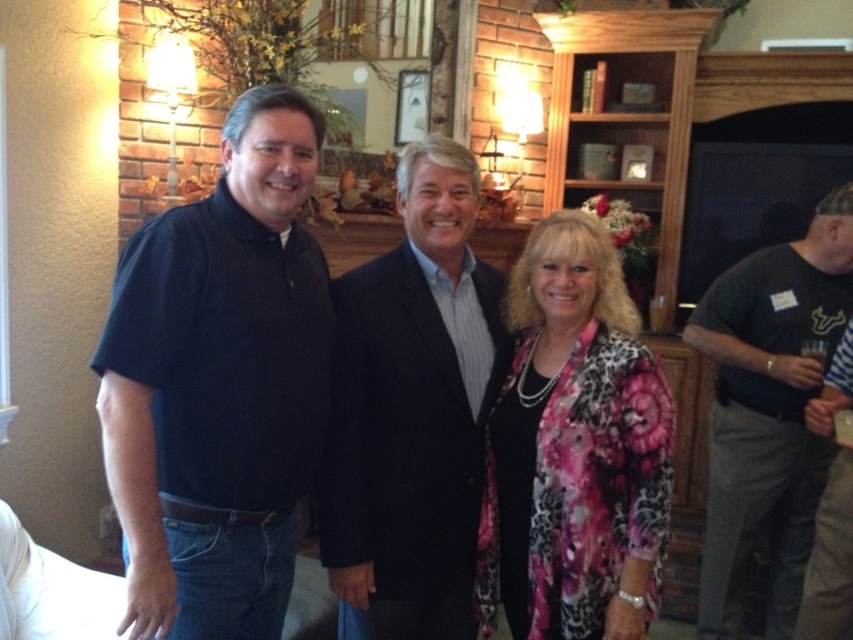
Question: Estimate the real-world distances between objects in this image. Which object is farther from the striped shirt at right?

Choices:
 (A) dark blue suit at center
 (B) dark gray t-shirt at right
 (C) pink floral jacket at center
 (D) dark blue polo shirt at left

Answer: (D)

Question: Does dark blue polo shirt at left have a larger size compared to pink floral jacket at center?

Choices:
 (A) no
 (B) yes

Answer: (B)

Question: Can you confirm if dark blue polo shirt at left is wider than dark blue suit at center?

Choices:
 (A) yes
 (B) no

Answer: (B)

Question: Which object is positioned farthest from the dark blue suit at center?

Choices:
 (A) dark blue polo shirt at left
 (B) dark gray t-shirt at right
 (C) striped shirt at right
 (D) pink floral jacket at center

Answer: (B)

Question: Estimate the real-world distances between objects in this image. Which object is closer to the pink floral jacket at center?

Choices:
 (A) dark gray t-shirt at right
 (B) dark blue polo shirt at left
 (C) striped shirt at right

Answer: (B)

Question: Is dark blue suit at center wider than pink floral jacket at center?

Choices:
 (A) no
 (B) yes

Answer: (B)